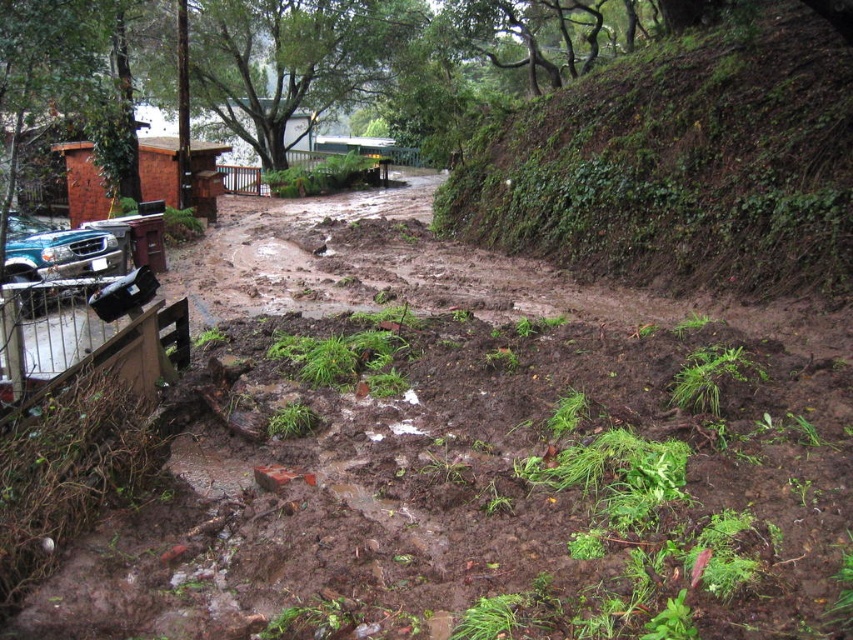
Is point (598, 260) positioned before point (35, 246)?

No, (598, 260) is behind (35, 246).

Which is in front, point (706, 237) or point (57, 240)?

Point (706, 237) is in front.

At what (x,y) coordinates should I click in order to perform the action: click on green mossy hillside at upper right. Please return your answer as a coordinate pair (x, y). This screenshot has height=640, width=853. Looking at the image, I should click on (679, 164).